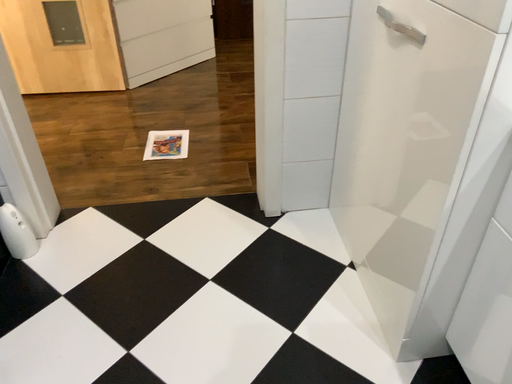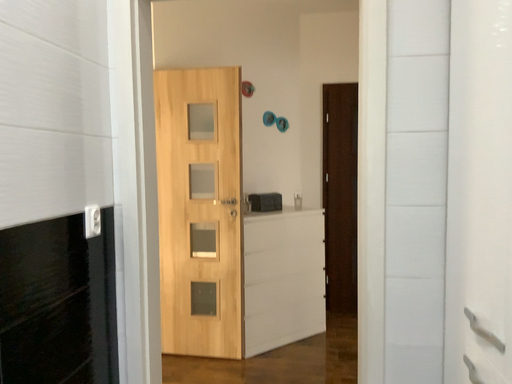
Question: How did the camera likely rotate when shooting the video?

Choices:
 (A) rotated downward
 (B) rotated upward

Answer: (B)